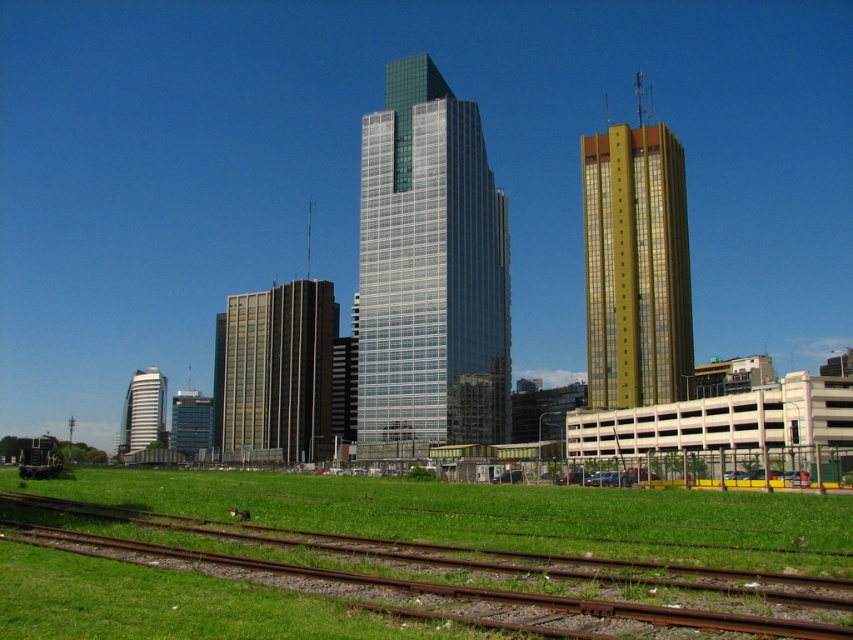
You are a city planner evaluating the space between the glassy silver skyscraper at center and the brown glass building at center. The city requires a minimum of 40 meters between such structures for safety. Does the current distance meet the requirement?

The glassy silver skyscraper at center and the brown glass building at center are 43.63 meters apart, which exceeds the required 40 meters, so the current distance meets the safety requirement.

You are standing in the urban landscape scene. There are two points marked in the image. The first point is at coordinates point (677, 353) and the second is at point (314, 438). Which of these two points is closer to your current position?

Point (677, 353) is closer to the camera than point (314, 438), so the first point is closer to your current position.

You are a city planner evaluating the urban layout. You need to determine which building, the glassy silver skyscraper at center or the white glossy building at center, has a greater overall footprint in the cityscape. Based on their sizes, which one would you estimate occupies more space?

The glassy silver skyscraper at center is larger in size than the white glossy building at center, so it likely has a greater footprint and occupies more space in the cityscape.